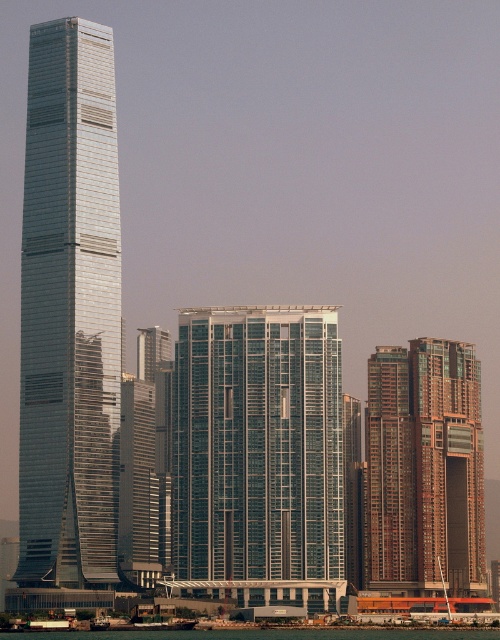
You are standing in the city square and want to take a photo of both the glassy metallic building at center and the brown glassy building at right. Which building should you position yourself closer to in order to capture both in the same frame?

You should position yourself closer to the glassy metallic building at center because it is nearer to you than the brown glassy building at right, allowing both to be included in the frame without zooming out too much.

You are an architect planning to install a flagpole on the shiny glass skyscraper at left and the brown glassy building at right. Since the flagpole must be placed at the highest point of each building, which building will have its flagpole at a higher elevation?

The shiny glass skyscraper at left is much taller than the brown glassy building at right, so its flagpole will be at a higher elevation.

You are a city planner analyzing the layout of the city. You notice the glassy metallic building at center and the brown glassy building at right. Which building is located to the left of the other?

The glassy metallic building at center is positioned on the left side of brown glassy building at right.